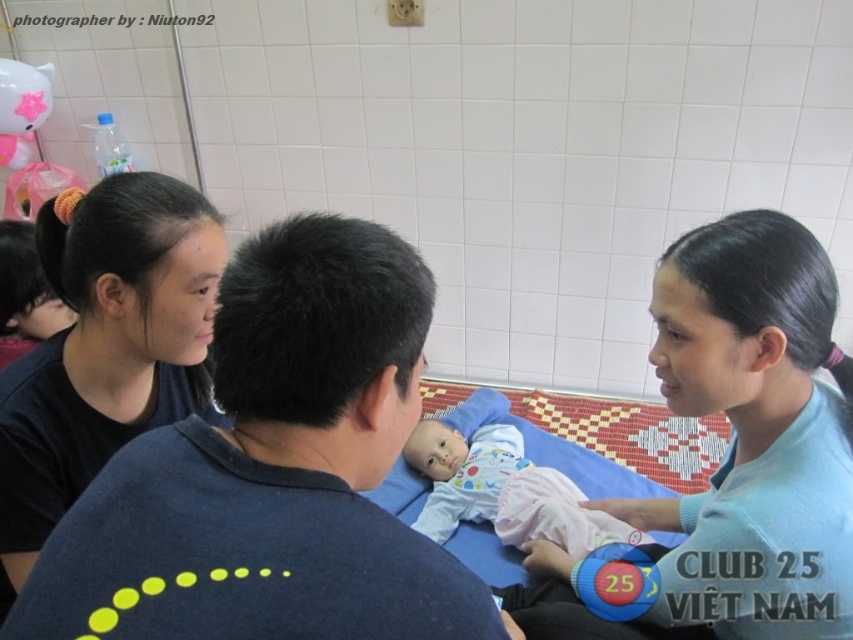
Who is more distant from viewer, (x=701, y=305) or (x=421, y=442)?

The point (x=421, y=442) is more distant.

Between light blue fabric at right and light pink fabric baby at center, which one is positioned lower?

light pink fabric baby at center is lower down.

Where is `light blue fabric at right`? The width and height of the screenshot is (853, 640). light blue fabric at right is located at coordinates (738, 449).

Who is lower down, dark blue t-shirt at center or black matte hair at upper left?

black matte hair at upper left is below.

Who is taller, dark blue t-shirt at center or black matte hair at upper left?

black matte hair at upper left

Which is in front, point (148, 564) or point (26, 372)?

Positioned in front is point (148, 564).

This screenshot has height=640, width=853. In order to click on dark blue t-shirt at center in this screenshot , I will do `click(273, 472)`.

Which is more to the left, black matte hair at upper left or light pink fabric baby at center?

black matte hair at upper left

Can you confirm if black matte hair at upper left is taller than light pink fabric baby at center?

Yes, black matte hair at upper left is taller than light pink fabric baby at center.

Identify the location of black matte hair at upper left. (105, 346).

Identify the location of black matte hair at upper left. (105, 346).